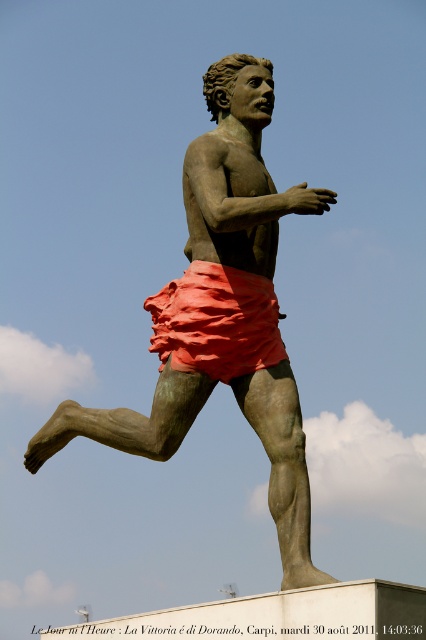
You are an art student analyzing the composition of the image. The bronze statue at center is positioned at a specific coordinate. What coordinate is it located at?

The bronze statue at center is located at point (221, 314).

You are a photographer standing at a certain distance from the bronze statue at center. You want to take a photo of it but your camera can only focus on objects within 50 meters. Will the statue be in focus?

The bronze statue at center is 69.10 meters from camera, which is beyond the camera focus range of 50 meters. Therefore, the statue will not be in focus.

Looking at this image, you are an art conservator assessing the bronze statue at center and the matte orange fabric shorts at center. You need to place a protective barrier around both items. What is the minimum width required for the barrier to accommodate both objects without overlapping?

The minimum width required for the barrier is 5.89 feet, as this is the distance between the bronze statue at center and the matte orange fabric shorts at center, ensuring they are both included without overlapping.